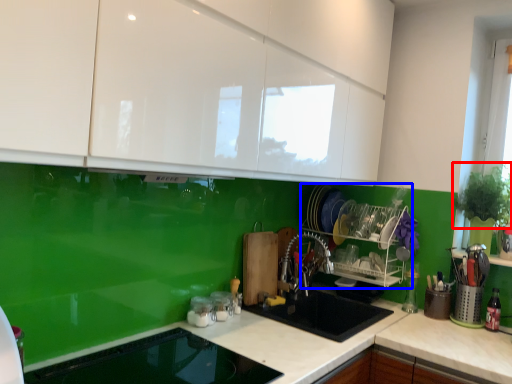
Question: Which object appears farthest to the camera in this image, plant (highlighted by a red box) or appliance (highlighted by a blue box)?

Choices:
 (A) plant
 (B) appliance

Answer: (B)